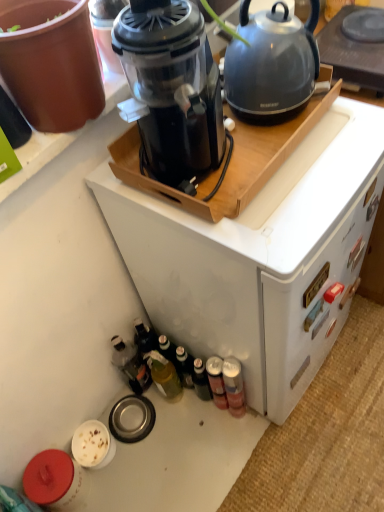
Image resolution: width=384 pixels, height=512 pixels. Identify the location of vacant space in front of metallic silver can at lower right, which is the 4th bottle from left to right. (232, 455).